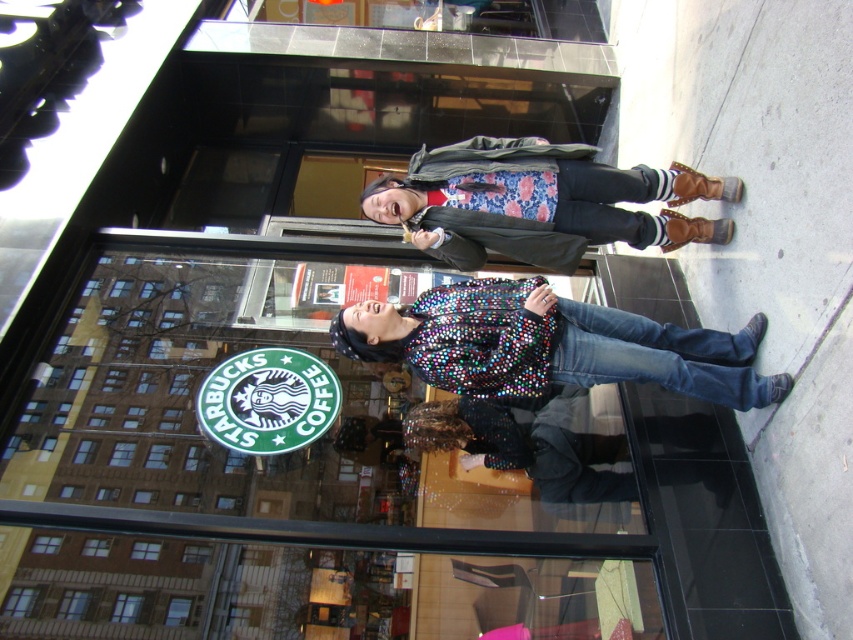
Question: Among these points, which one is farthest from the camera?

Choices:
 (A) (761, 378)
 (B) (549, 156)

Answer: (B)

Question: Can you confirm if shiny sequined jacket at center is smaller than floral fabric shirt at center?

Choices:
 (A) no
 (B) yes

Answer: (B)

Question: Is shiny sequined jacket at center above floral fabric shirt at center?

Choices:
 (A) no
 (B) yes

Answer: (A)

Question: Can you confirm if shiny sequined jacket at center is wider than floral fabric shirt at center?

Choices:
 (A) yes
 (B) no

Answer: (A)

Question: Which object is farther from the camera taking this photo?

Choices:
 (A) floral fabric shirt at center
 (B) shiny sequined jacket at center

Answer: (A)